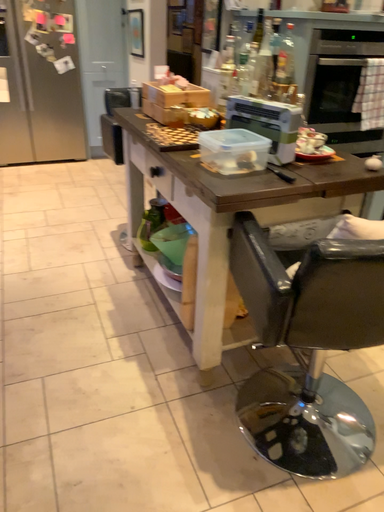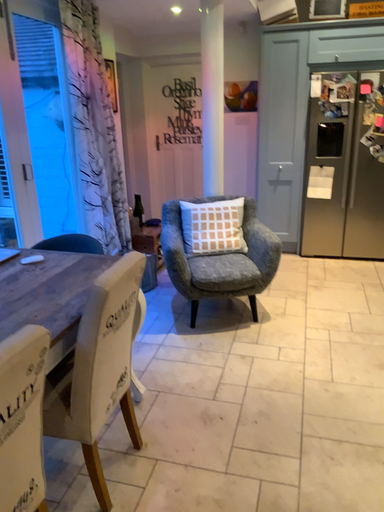
Question: How did the camera likely rotate when shooting the video?

Choices:
 (A) rotated upward
 (B) rotated downward

Answer: (A)